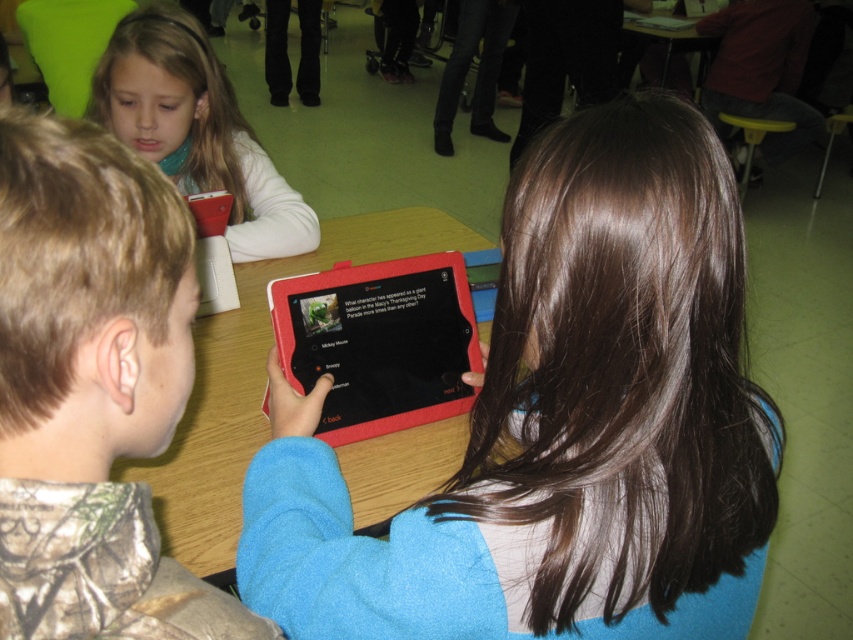
You are a teacher in the classroom and need to hand out two different tablets to students. The first tablet is the matte black tablet at center, and the second is the rubberized black tablet at center. Which tablet should you choose if you want to give the larger one to a student with bigger hands?

The matte black tablet at center is bigger than the rubberized black tablet at center, so you should choose the matte black tablet at center for the student with bigger hands.

You are a teacher observing the classroom. You notice two tablets at the center of the image. Which tablet is positioned lower between the matte black tablet at center and the rubberized black tablet at center?

The matte black tablet at center is positioned below the rubberized black tablet at center, so it is lower.